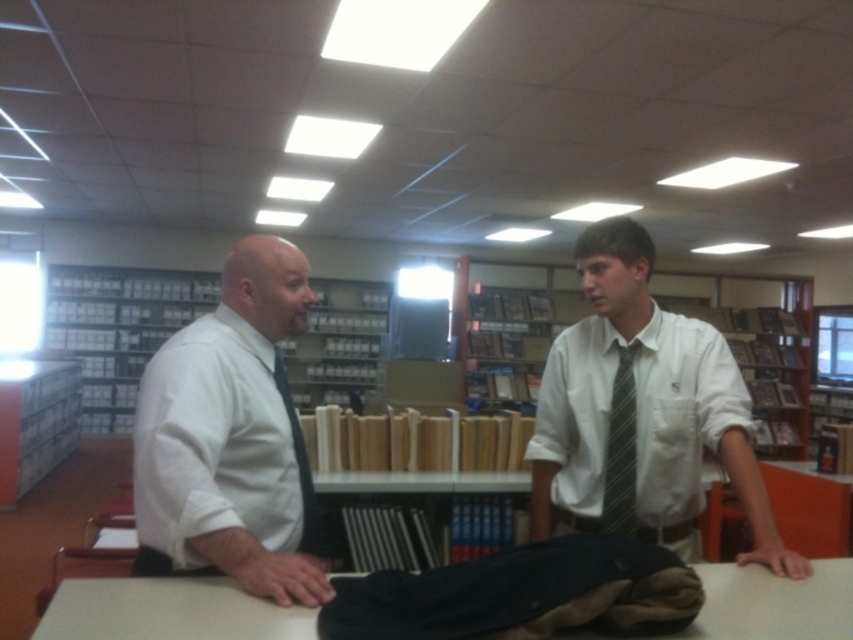
You are standing in the library and notice two people talking. You see a white shirt with tie at center and a green striped tie at center. Which one is positioned to the right?

The white shirt with tie at center is positioned to the right of the green striped tie at center.

You are taking a photo of two points in the scene. The first point is labeled as point (267, 532) and the second is point (305, 481). Which point will appear larger in your photo?

Point (267, 532) is closer to the camera than point (305, 481), so it will appear larger in the photo.